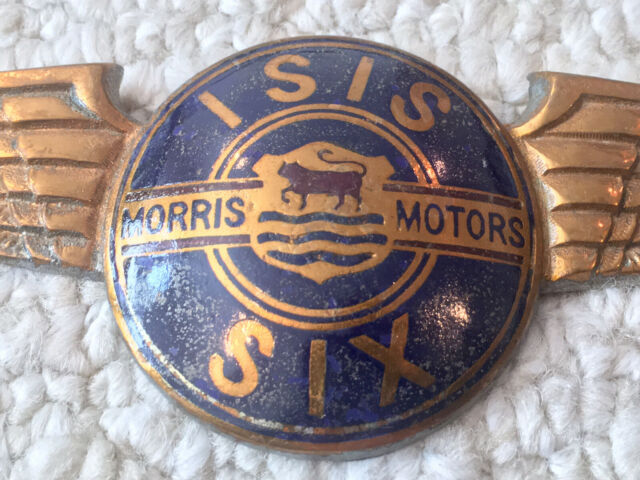
Identify the location of light reflections. The height and width of the screenshot is (480, 640). (157, 281).